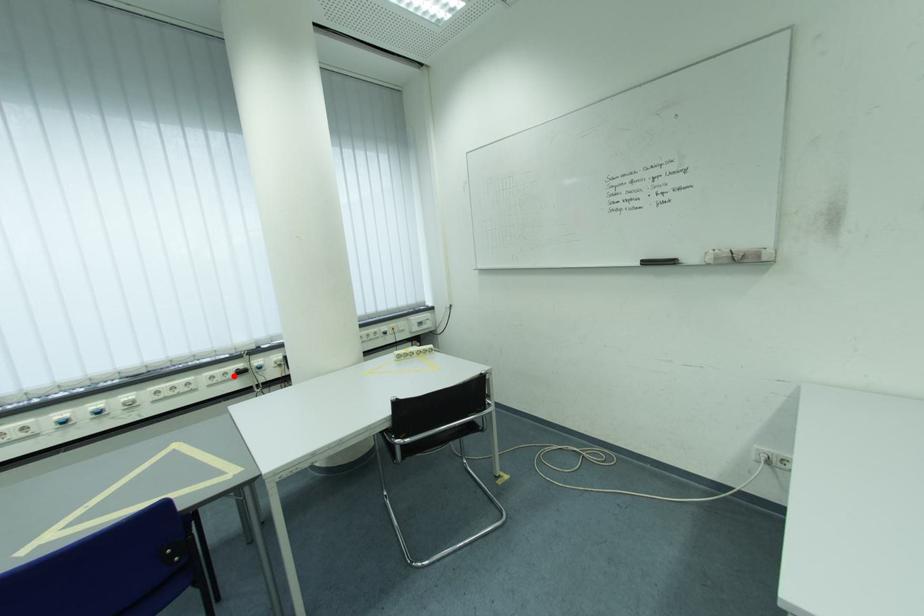
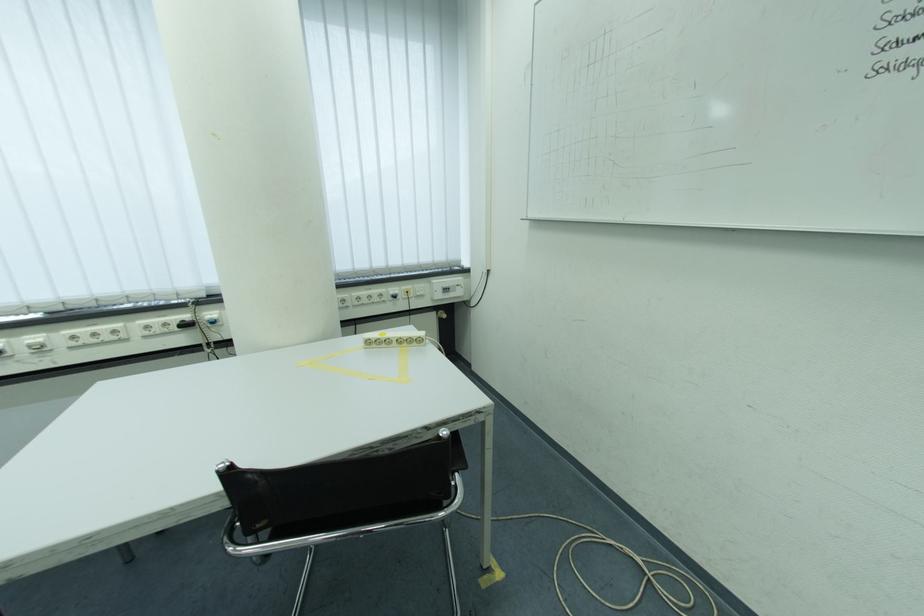
The point at the highlighted location is marked in the first image. Where is the corresponding point in the second image?

(175, 326)